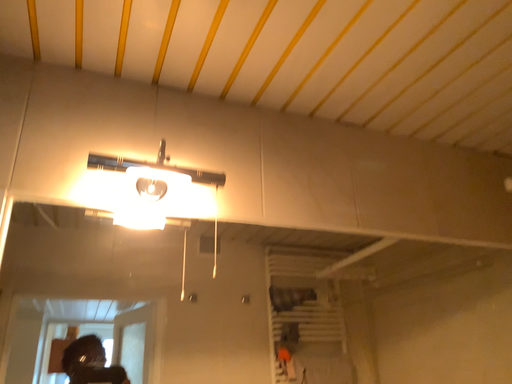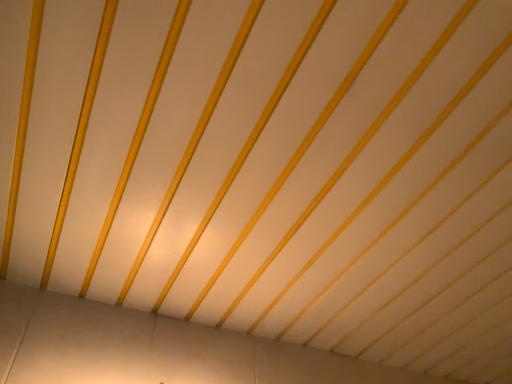
Question: Which way did the camera rotate in the video?

Choices:
 (A) rotated upward
 (B) rotated downward

Answer: (A)